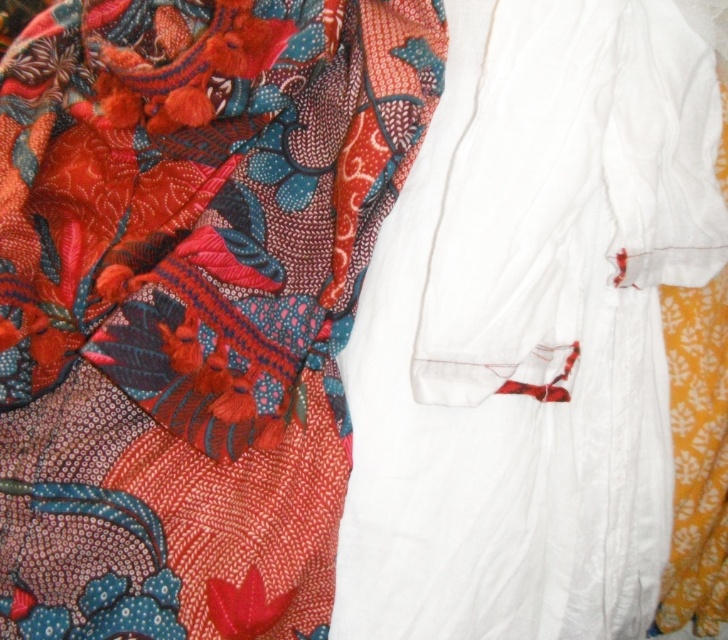
Which is in front, point (555, 572) or point (233, 257)?

Point (233, 257)

Can you confirm if white cotton robe at center is shorter than floral silk scarf at upper left?

Incorrect, white cotton robe at center's height does not fall short of floral silk scarf at upper left's.

Between point (491, 282) and point (0, 340), which one is positioned behind?

Point (0, 340)

Locate an element on the screen. white cotton robe at center is located at coordinates (529, 330).